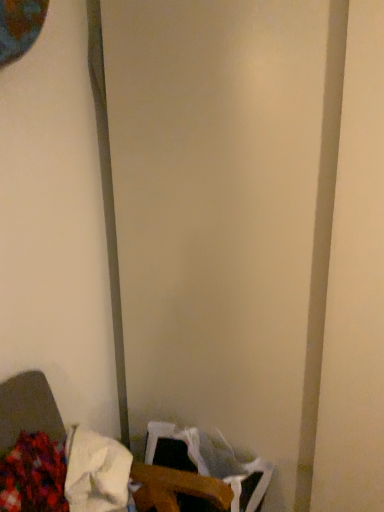
Question: Considering the positions of wooden table at lower left and fluffy fabric at lower left, which appears as the second waste when viewed from the right, in the image, is wooden table at lower left bigger or smaller than fluffy fabric at lower left, which appears as the second waste when viewed from the right,?

Choices:
 (A) big
 (B) small

Answer: (A)

Question: Considering the relative positions of wooden table at lower left and fluffy fabric at lower left, which appears as the second waste when viewed from the right, in the image provided, is wooden table at lower left to the left or to the right of fluffy fabric at lower left, which appears as the second waste when viewed from the right,?

Choices:
 (A) right
 (B) left

Answer: (A)

Question: Which object is positioned closest to the wooden table at lower left?

Choices:
 (A) fluffy fabric at lower left, which is counted as the 1th waste, starting from the left
 (B) white fabric at lower left, the 1th waste in the right-to-left sequence

Answer: (B)

Question: Estimate the real-world distances between objects in this image. Which object is farther from the fluffy fabric at lower left, which appears as the second waste when viewed from the right?

Choices:
 (A) white fabric at lower left, the 1th waste in the right-to-left sequence
 (B) wooden table at lower left

Answer: (A)